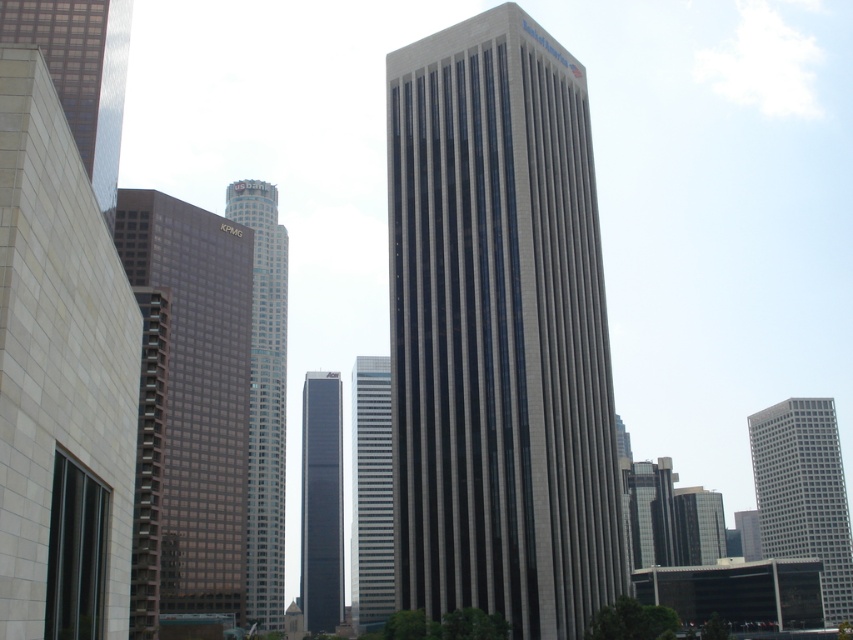
Which is above, white stone building at left or brown glassy building at center?

Positioned higher is white stone building at left.

Between white stone building at left and brown glassy building at center, which one appears on the left side from the viewer's perspective?

Positioned to the left is brown glassy building at center.

I want to click on white stone building at left, so click(61, 378).

Does brown glassy building at center have a greater width compared to gray glass skyscraper at center?

Yes, brown glassy building at center is wider than gray glass skyscraper at center.

Between brown glassy building at center and gray glass skyscraper at center, which one is positioned lower?

gray glass skyscraper at center is lower down.

Describe the element at coordinates (189, 404) in the screenshot. I see `brown glassy building at center` at that location.

The width and height of the screenshot is (853, 640). In order to click on brown glassy building at center in this screenshot , I will do `click(189, 404)`.

Does brown glassy building at center come behind reflective glass skyscraper at left?

No, it is in front of reflective glass skyscraper at left.

Is point (137, 218) positioned before point (96, 138)?

No, it is behind (96, 138).

Where is `brown glassy building at center`? This screenshot has width=853, height=640. brown glassy building at center is located at coordinates (189, 404).